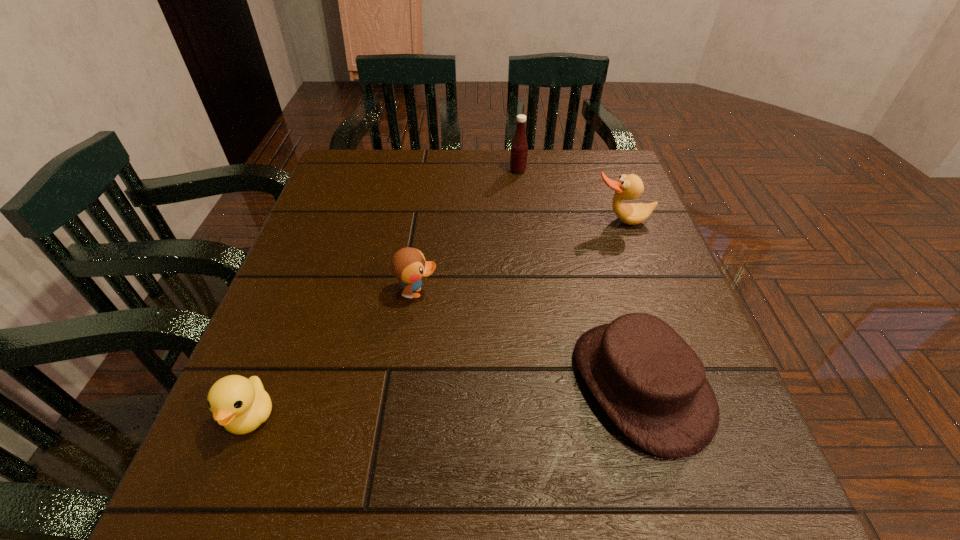
This screenshot has width=960, height=540. I want to click on the tallest object, so click(x=519, y=148).

Image resolution: width=960 pixels, height=540 pixels. Find the location of `the farthest object`. the farthest object is located at coordinates (519, 148).

Find the location of a particular element. This screenshot has height=540, width=960. the rightmost duck is located at coordinates (628, 187).

The height and width of the screenshot is (540, 960). I want to click on the farthest duck, so click(628, 187).

Identify the location of the second nearest duck. (408, 265).

You are a GUI agent. You are given a task and a screenshot of the screen. Output one action in this format:
    pyautogui.click(x=<x>, y=<y>)
    Task: Click on the fourth object from right to left
    
    Given the screenshot: What is the action you would take?
    pyautogui.click(x=408, y=265)

Locate an element on the screen. The width and height of the screenshot is (960, 540). the nearest duck is located at coordinates (241, 405).

Locate an element on the screen. The width and height of the screenshot is (960, 540). the leftmost object is located at coordinates (241, 405).

Where is `hat`? hat is located at coordinates (652, 385).

This screenshot has height=540, width=960. I want to click on vacant region located 0.200m on the right of the third object from left to right, so click(600, 171).